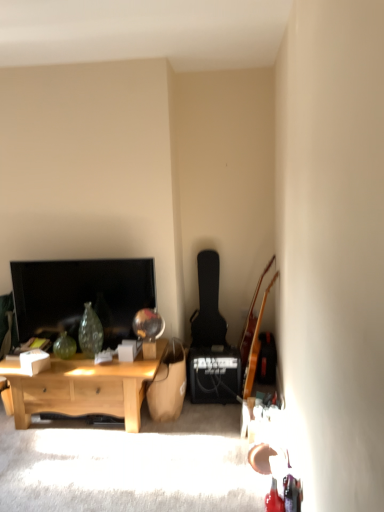
Question: Can you confirm if light wood desk at lower left is wider than wooden acoustic guitar at right, the 1th guitar positioned from the front?

Choices:
 (A) yes
 (B) no

Answer: (A)

Question: Is light wood desk at lower left closer to camera compared to wooden acoustic guitar at right, the second guitar viewed from the left?

Choices:
 (A) no
 (B) yes

Answer: (B)

Question: From a real-world perspective, is light wood desk at lower left positioned over wooden acoustic guitar at right, the 1th guitar positioned from the front, based on gravity?

Choices:
 (A) yes
 (B) no

Answer: (B)

Question: Is light wood desk at lower left touching wooden acoustic guitar at right, the 2th guitar from the back?

Choices:
 (A) no
 (B) yes

Answer: (A)

Question: From a real-world perspective, is light wood desk at lower left physically below wooden acoustic guitar at right, the 2th guitar from the back?

Choices:
 (A) no
 (B) yes

Answer: (B)

Question: Is point (208, 298) closer or farther from the camera than point (109, 296)?

Choices:
 (A) closer
 (B) farther

Answer: (B)

Question: In the image, is black matte guitar at center-right, which is the first guitar in back-to-front order, positioned in front of or behind matte black tv at left?

Choices:
 (A) front
 (B) behind

Answer: (B)

Question: In terms of size, does black matte guitar at center-right, which is counted as the 1th guitar, starting from the left, appear bigger or smaller than matte black tv at left?

Choices:
 (A) big
 (B) small

Answer: (A)

Question: Is black matte guitar at center-right, which is counted as the 1th guitar, starting from the left, inside or outside of matte black tv at left?

Choices:
 (A) inside
 (B) outside

Answer: (B)

Question: From a real-world perspective, is light wood desk at lower left positioned above or below black matte guitar at center-right, which is the first guitar in back-to-front order?

Choices:
 (A) below
 (B) above

Answer: (A)

Question: Is light wood desk at lower left taller or shorter than black matte guitar at center-right, which is the second guitar from right to left?

Choices:
 (A) tall
 (B) short

Answer: (B)

Question: Looking at the image, does light wood desk at lower left seem bigger or smaller compared to black matte guitar at center-right, which is the first guitar in back-to-front order?

Choices:
 (A) big
 (B) small

Answer: (A)

Question: From the image's perspective, is light wood desk at lower left above or below black matte guitar at center-right, which is the first guitar in back-to-front order?

Choices:
 (A) below
 (B) above

Answer: (A)

Question: Considering the positions of point (129, 415) and point (253, 362), is point (129, 415) closer or farther from the camera than point (253, 362)?

Choices:
 (A) closer
 (B) farther

Answer: (A)

Question: Is light wood desk at lower left situated inside wooden acoustic guitar at right, the 2th guitar from the back, or outside?

Choices:
 (A) inside
 (B) outside

Answer: (B)